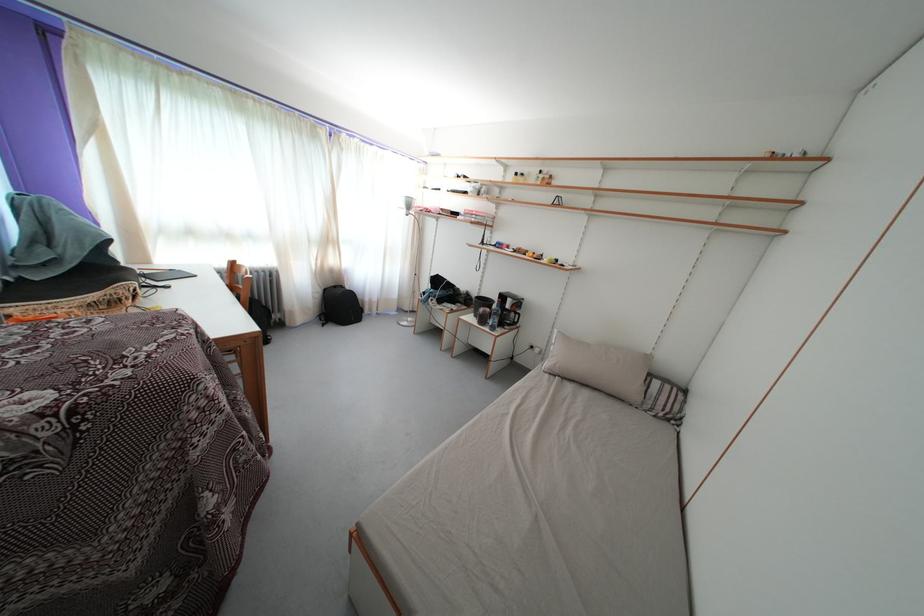
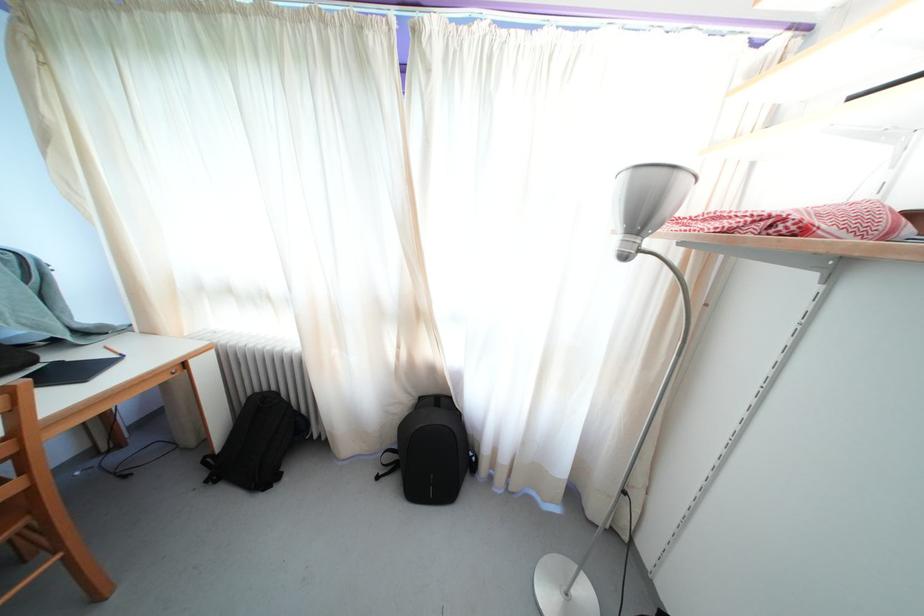
In the second image, find the point that corresponds to the point at 332,296 in the first image.

(427, 405)